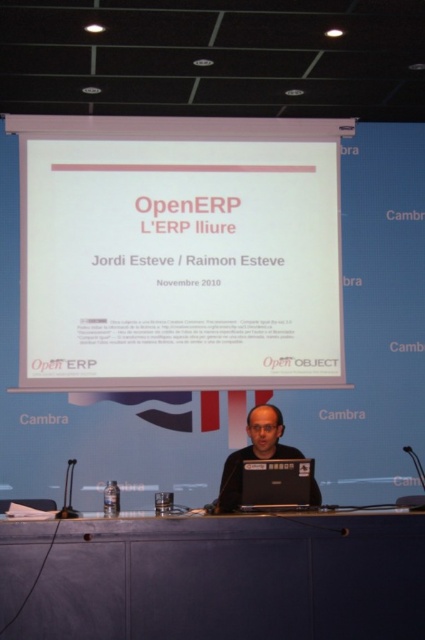
Question: Which point is closer to the camera?

Choices:
 (A) matte black laptop at center
 (B) black glossy laptop at center
 (C) dark gray matte table at center
 (D) white paper at center

Answer: (C)

Question: Which of the following is the farthest from the observer?

Choices:
 (A) (280, 428)
 (B) (319, 502)

Answer: (A)

Question: In this image, where is dark gray matte table at center located relative to matte black laptop at center?

Choices:
 (A) right
 (B) left

Answer: (B)

Question: Can you confirm if white paper at center is wider than black glossy laptop at center?

Choices:
 (A) yes
 (B) no

Answer: (A)

Question: Can you confirm if matte black laptop at center is bigger than black glossy laptop at center?

Choices:
 (A) yes
 (B) no

Answer: (A)

Question: Which is farther from the dark gray matte table at center?

Choices:
 (A) matte black laptop at center
 (B) white paper at center
 (C) black glossy laptop at center

Answer: (B)